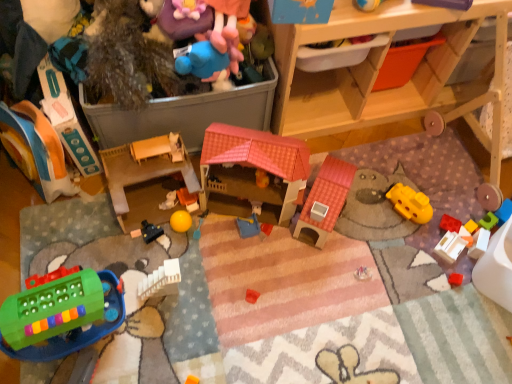
This screenshot has height=384, width=512. What are the coordinates of `space that is in front of yellow rubber ball at center, the 6th toy from the left` in the screenshot? It's located at click(x=153, y=268).